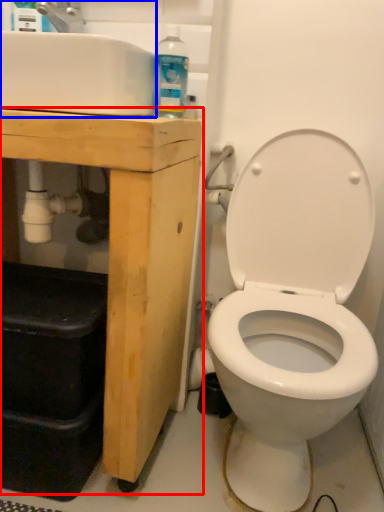
Question: Among these objects, which one is farthest to the camera, porcelain (highlighted by a red box) or sink (highlighted by a blue box)?

Choices:
 (A) porcelain
 (B) sink

Answer: (A)